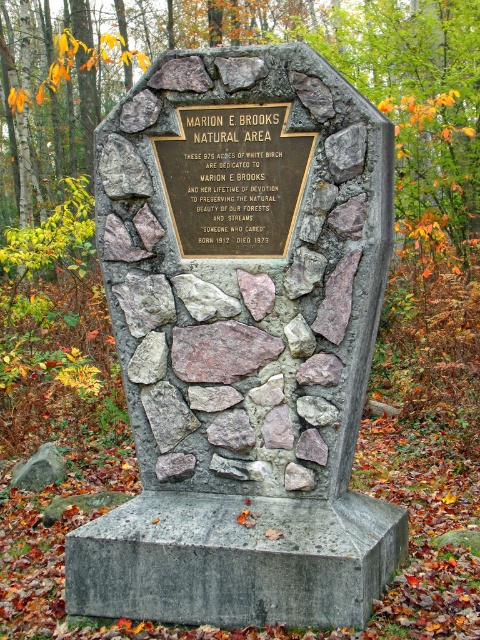
Question: Does rustic stone marker at center have a greater width compared to rusty stone at center?

Choices:
 (A) no
 (B) yes

Answer: (B)

Question: Can you confirm if rustic stone marker at center is bigger than rusty stone at center?

Choices:
 (A) yes
 (B) no

Answer: (A)

Question: Which point appears farthest from the camera in this image?

Choices:
 (A) (152, 81)
 (B) (252, 435)
 (C) (213, 339)
 (D) (37, 480)

Answer: (D)

Question: Which of these objects is positioned farthest from the rusty stone at center?

Choices:
 (A) gray rough stone at center
 (B) gold polished metal plaque at center
 (C) gray rock at center

Answer: (C)

Question: Can you confirm if rustic stone marker at center is bigger than gold polished metal plaque at center?

Choices:
 (A) yes
 (B) no

Answer: (A)

Question: Which point appears farthest from the camera in this image?

Choices:
 (A) (206, 344)
 (B) (56, 461)
 (C) (237, 449)
 (D) (291, 172)

Answer: (B)